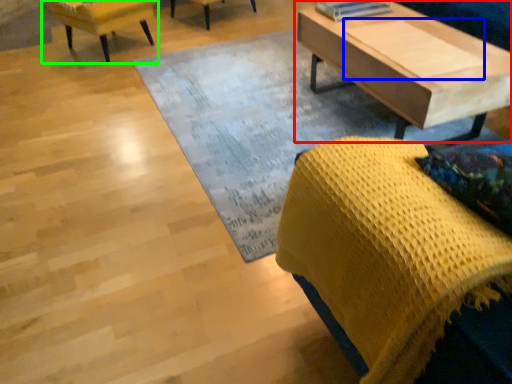
Question: Based on their relative distances, which object is farther from coffee table (highlighted by a red box)? Choose from plank (highlighted by a blue box) and chair (highlighted by a green box).

Choices:
 (A) plank
 (B) chair

Answer: (B)